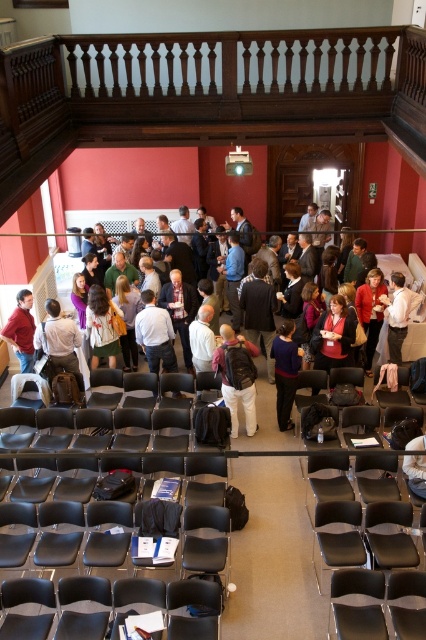
Between point (230, 346) and point (408, 456), which one is positioned in front?

Point (408, 456)

Can you confirm if dark gray backpack at center is bigger than matte black jacket at center?

Correct, dark gray backpack at center is larger in size than matte black jacket at center.

Identify the location of dark gray backpack at center. The image size is (426, 640). (233, 385).

From the picture: Does black leather chair at lower center have a larger size compared to matte black chair at lower right?

Correct, black leather chair at lower center is larger in size than matte black chair at lower right.

Is black leather chair at lower center wider than matte black chair at lower right?

Yes.

Is point (72, 605) closer to viewer compared to point (342, 589)?

That is False.

Locate an element on the screen. The image size is (426, 640). black leather chair at lower center is located at coordinates (112, 544).

Between dark gray backpack at center and matte red shirt at center, which one is positioned higher?

matte red shirt at center

Which of these two, dark gray backpack at center or matte red shirt at center, stands taller?

dark gray backpack at center

This screenshot has height=640, width=426. What do you see at coordinates (233, 385) in the screenshot?
I see `dark gray backpack at center` at bounding box center [233, 385].

Identify the location of dark gray backpack at center. This screenshot has width=426, height=640. (233, 385).